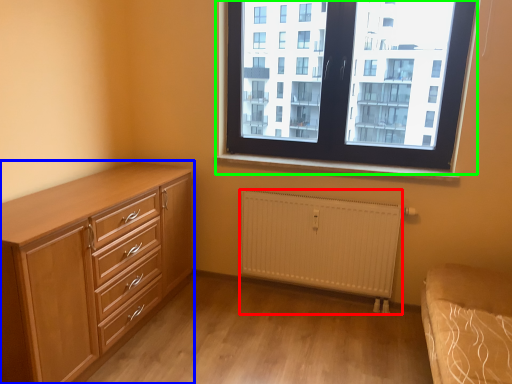
Question: Which is nearer to the radiator (highlighted by a red box)? chest of drawers (highlighted by a blue box) or window (highlighted by a green box).

Choices:
 (A) chest of drawers
 (B) window

Answer: (B)